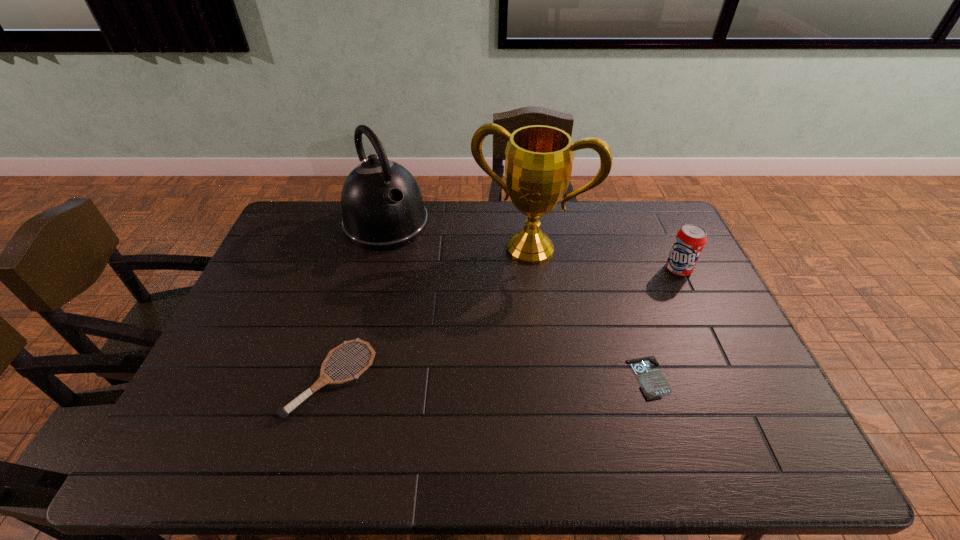
Where is `object that stands as the second closest to the identity card`? object that stands as the second closest to the identity card is located at coordinates (538, 166).

I want to click on free space that satisfies the following two spatial constraints: 1. on the back side of the soda can; 2. on the right side of the shortest object, so click(x=614, y=269).

The image size is (960, 540). Find the location of `free space that satisfies the following two spatial constraints: 1. on the front side of the kettle; 2. on the left side of the shortest object`. free space that satisfies the following two spatial constraints: 1. on the front side of the kettle; 2. on the left side of the shortest object is located at coordinates (348, 378).